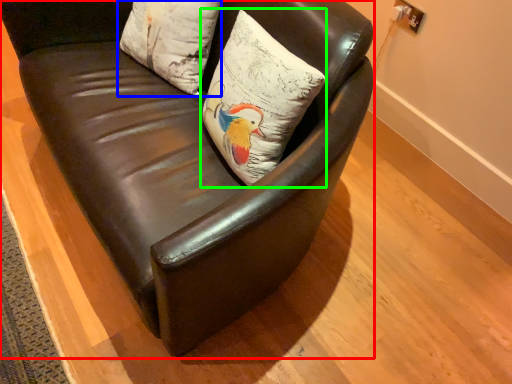
Question: Based on their relative distances, which object is farther from chair (highlighted by a red box)? Choose from pillow (highlighted by a blue box) and pillow (highlighted by a green box).

Choices:
 (A) pillow
 (B) pillow

Answer: (A)